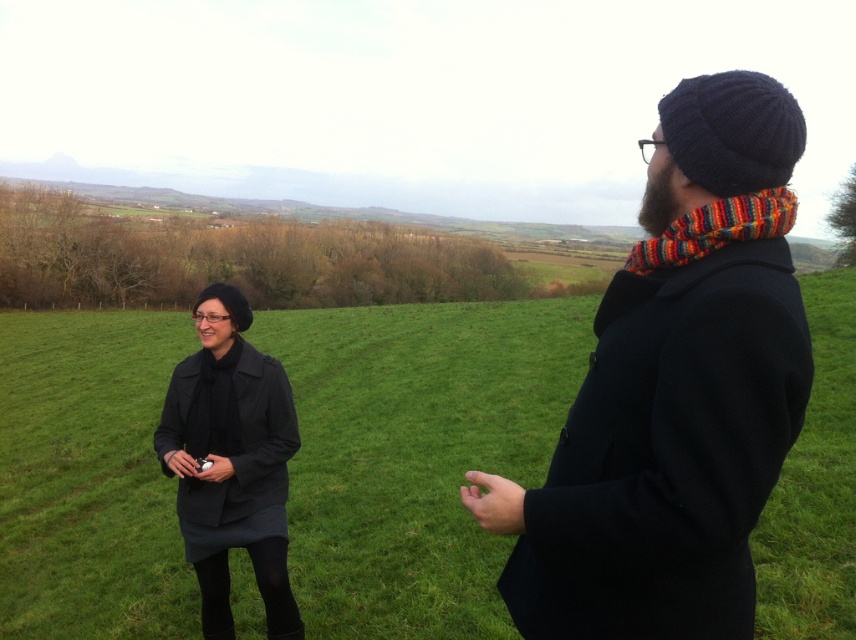
You are standing in a grassy field with two people. You notice two points in the scene labeled as point 1 and point 2. The first point is at coordinates (201, 458), and the second is at (788, 225). Which point is closer to you?

Point 1 at coordinates (201, 458) is closer to you because it is further to the viewer than point 2 at (788, 225).

From the picture: You are a photographer trying to capture a photo of the knitted multicolored scarf at right from the green grassy field at center. Can you see the scarf clearly from that position?

The green grassy field at center is above the knitted multicolored scarf at right, so you can see the scarf clearly from the field.